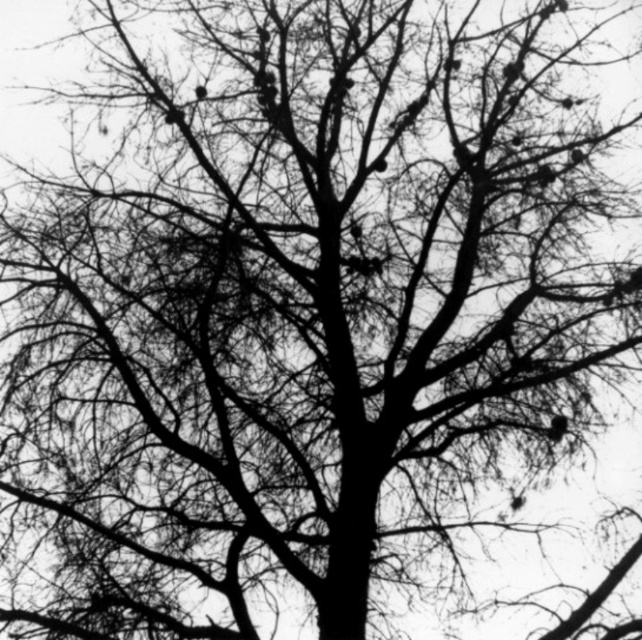
Question: Which of the following is the farthest from the observer?

Choices:
 (A) silky black bird at upper right
 (B) dark brown feathered bird at upper center

Answer: (B)

Question: Does silky black bird at upper right have a larger size compared to dark brown feathered bird at upper center?

Choices:
 (A) no
 (B) yes

Answer: (B)

Question: Among these points, which one is nearest to the camera?

Choices:
 (A) (204, 90)
 (B) (559, 428)

Answer: (B)

Question: Can you confirm if silky black bird at upper right is bigger than dark brown feathered bird at upper center?

Choices:
 (A) no
 (B) yes

Answer: (B)

Question: Can you confirm if silky black bird at upper right is positioned above dark brown feathered bird at upper center?

Choices:
 (A) yes
 (B) no

Answer: (B)